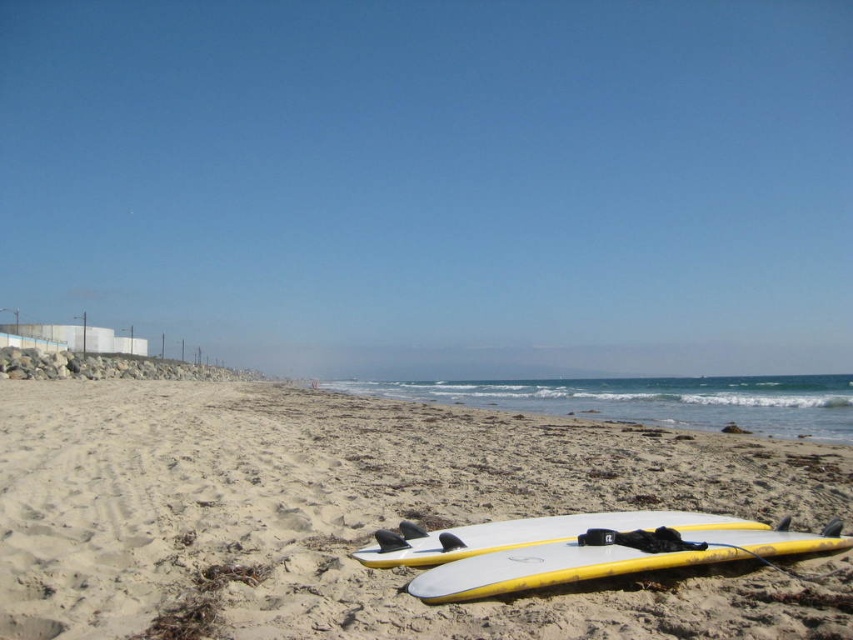
Which is in front, point (122, 582) or point (671, 563)?

Point (671, 563) is more forward.

I want to click on white sand at lower center, so click(x=367, y=515).

Locate an element on the screen. The height and width of the screenshot is (640, 853). white sand at lower center is located at coordinates (367, 515).

Where is `white sand at lower center`? Image resolution: width=853 pixels, height=640 pixels. white sand at lower center is located at coordinates (367, 515).

Can you confirm if yellow matte surfboard at lower center is positioned to the left of white/yellow foam surfboard at lower center?

In fact, yellow matte surfboard at lower center is to the right of white/yellow foam surfboard at lower center.

Is yellow matte surfboard at lower center smaller than white/yellow foam surfboard at lower center?

No, yellow matte surfboard at lower center is not smaller than white/yellow foam surfboard at lower center.

Does point (683, 545) lie behind point (608, 515)?

No, (683, 545) is closer to viewer.

At what (x,y) coordinates should I click in order to perform the action: click on yellow matte surfboard at lower center. Please return your answer as a coordinate pair (x, y). This screenshot has width=853, height=640. Looking at the image, I should click on (x=613, y=557).

Which is more to the left, white sand at lower center or white/yellow foam surfboard at lower center?

white sand at lower center is more to the left.

Who is higher up, white sand at lower center or white/yellow foam surfboard at lower center?

white/yellow foam surfboard at lower center is above.

At what (x,y) coordinates should I click in order to perform the action: click on white sand at lower center. Please return your answer as a coordinate pair (x, y). The width and height of the screenshot is (853, 640). Looking at the image, I should click on (367, 515).